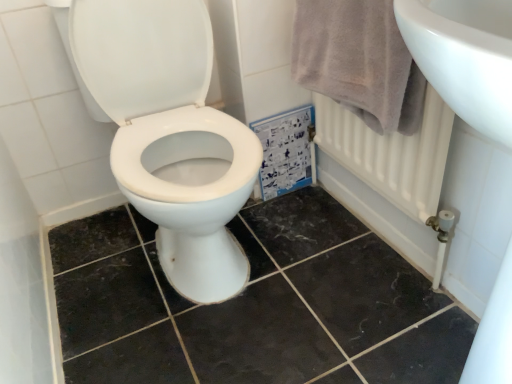
Question: Considering the positions of point (145, 152) and point (382, 117), is point (145, 152) closer or farther from the camera than point (382, 117)?

Choices:
 (A) farther
 (B) closer

Answer: (A)

Question: Would you say white glossy toilet at center is inside or outside light gray cotton towel at upper right?

Choices:
 (A) inside
 (B) outside

Answer: (B)

Question: Which object is the closest to the black marble tile at center?

Choices:
 (A) light gray cotton towel at upper right
 (B) white glossy toilet at center

Answer: (B)

Question: Which object is the farthest from the black marble tile at center?

Choices:
 (A) white glossy toilet at center
 (B) light gray cotton towel at upper right

Answer: (B)